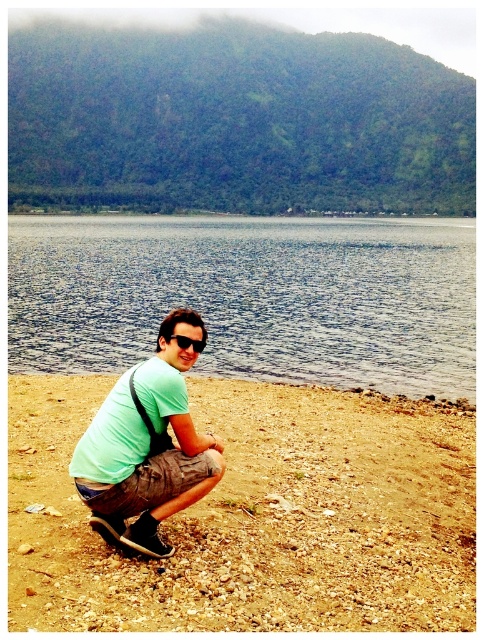
Can you confirm if brown gravelly sand at lower center is smaller than black plastic sunglasses at center?

No.

Which is in front, point (351, 536) or point (169, 339)?

Point (169, 339) is more forward.

Who is more forward, (x=218, y=506) or (x=195, y=339)?

Point (x=195, y=339)

The width and height of the screenshot is (484, 640). I want to click on brown gravelly sand at lower center, so click(256, 516).

In the scene shown: Does brown gravelly sand at lower center have a lesser width compared to green matte shirt at center?

Incorrect, brown gravelly sand at lower center's width is not less than green matte shirt at center's.

Does brown gravelly sand at lower center appear over green matte shirt at center?

Actually, brown gravelly sand at lower center is below green matte shirt at center.

What do you see at coordinates (256, 516) in the screenshot? I see `brown gravelly sand at lower center` at bounding box center [256, 516].

Locate an element on the screen. brown gravelly sand at lower center is located at coordinates (256, 516).

Locate an element on the screen. Image resolution: width=484 pixels, height=640 pixels. brown gravelly sand at lower center is located at coordinates (256, 516).

Can you confirm if brown gravelly sand at lower center is wider than blue water at center?

In fact, brown gravelly sand at lower center might be narrower than blue water at center.

Is point (317, 493) positioned in front of point (133, 355)?

Yes, it is in front of point (133, 355).

Locate an element on the screen. brown gravelly sand at lower center is located at coordinates (256, 516).